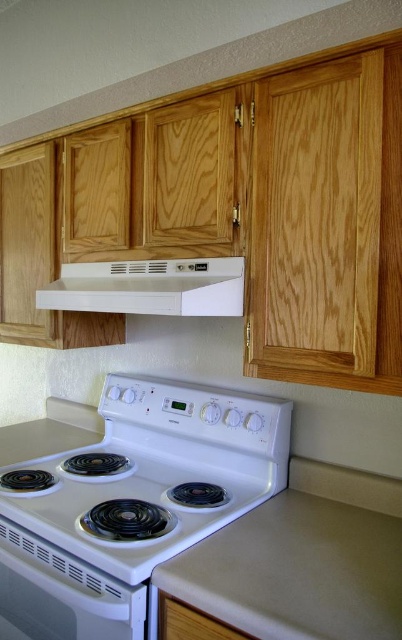
Based on the photo, who is lower down, white glossy electric stove at lower left or white matte exhaust hood at center?

Positioned lower is white glossy electric stove at lower left.

Is white glossy electric stove at lower left closer to camera compared to white matte exhaust hood at center?

That is True.

Does point (47, 628) lie in front of point (104, 291)?

Yes, it is.

This screenshot has width=402, height=640. In order to click on white glossy electric stove at lower left in this screenshot , I will do `click(63, 593)`.

Is point (131, 552) behind point (102, 272)?

No.

Is white glossy electric stove at center positioned at the back of white matte exhaust hood at center?

That is False.

This screenshot has height=640, width=402. In order to click on white glossy electric stove at center in this screenshot , I will do `click(131, 502)`.

Where is `white glossy electric stove at center`? white glossy electric stove at center is located at coordinates (131, 502).

Is white glossy electric stove at center to the right of beige laminate counter top at lower center from the viewer's perspective?

In fact, white glossy electric stove at center is to the left of beige laminate counter top at lower center.

Which is in front, point (233, 412) or point (278, 515)?

Positioned in front is point (278, 515).

Locate an element on the screen. Image resolution: width=402 pixels, height=640 pixels. white glossy electric stove at center is located at coordinates 131,502.